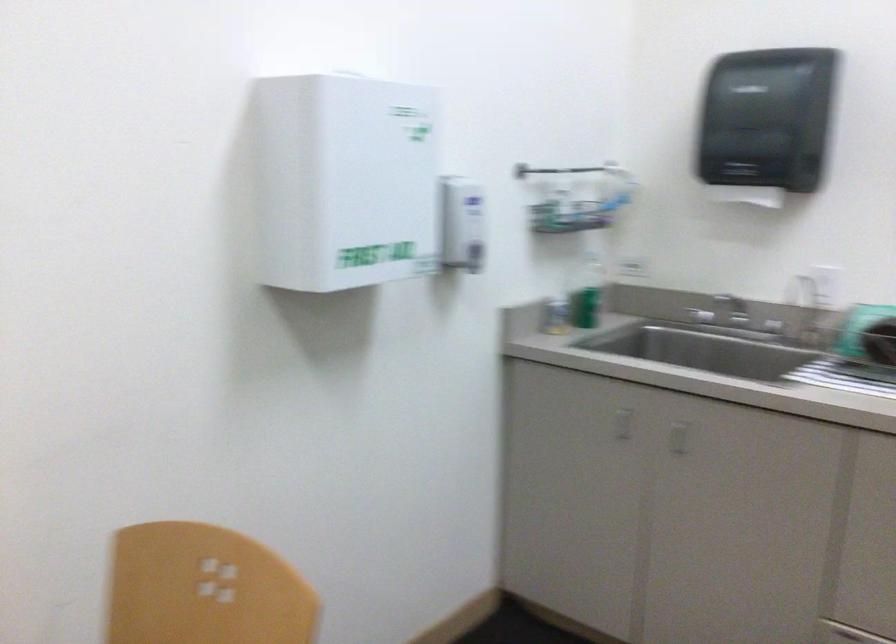
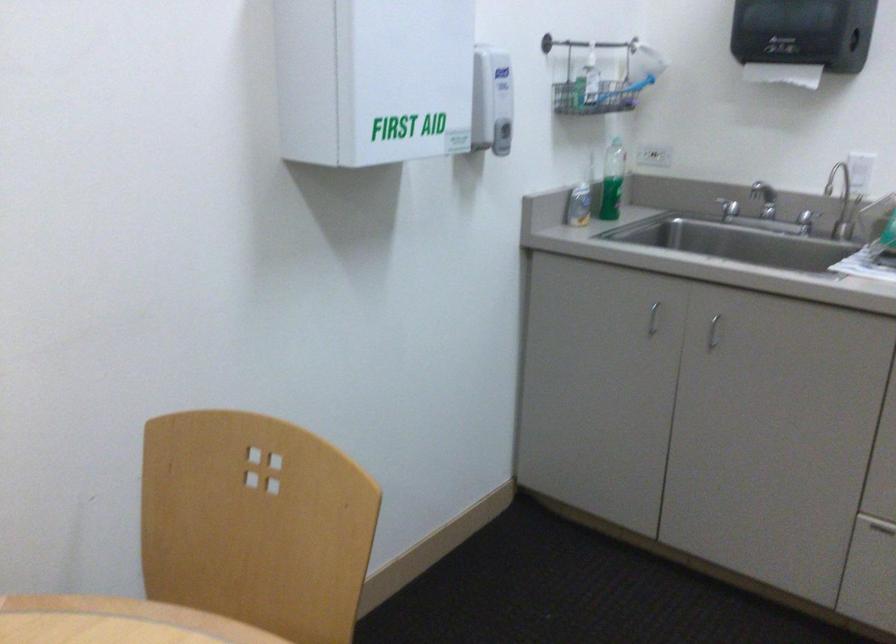
Locate, in the second image, the point that corresponds to point (736, 199) in the first image.

(782, 73)